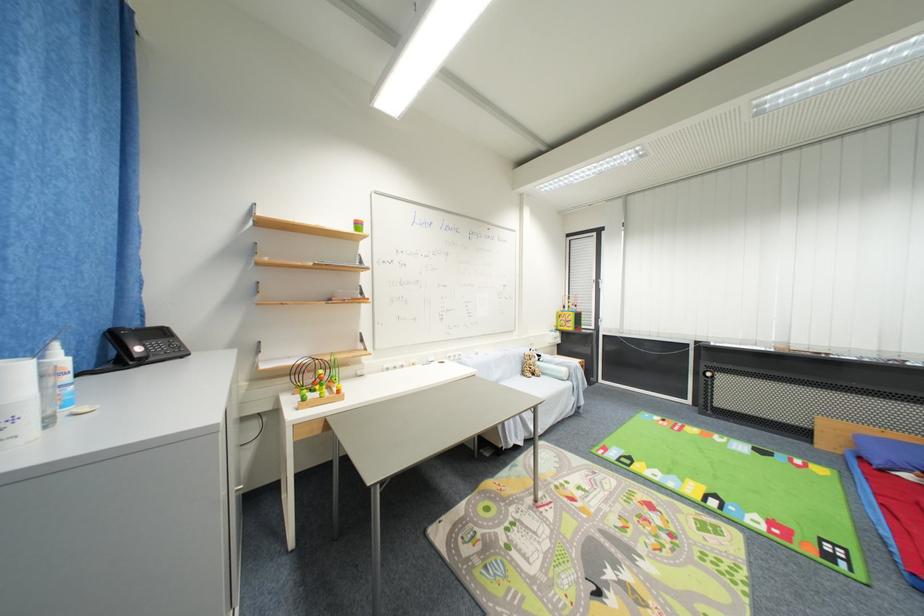
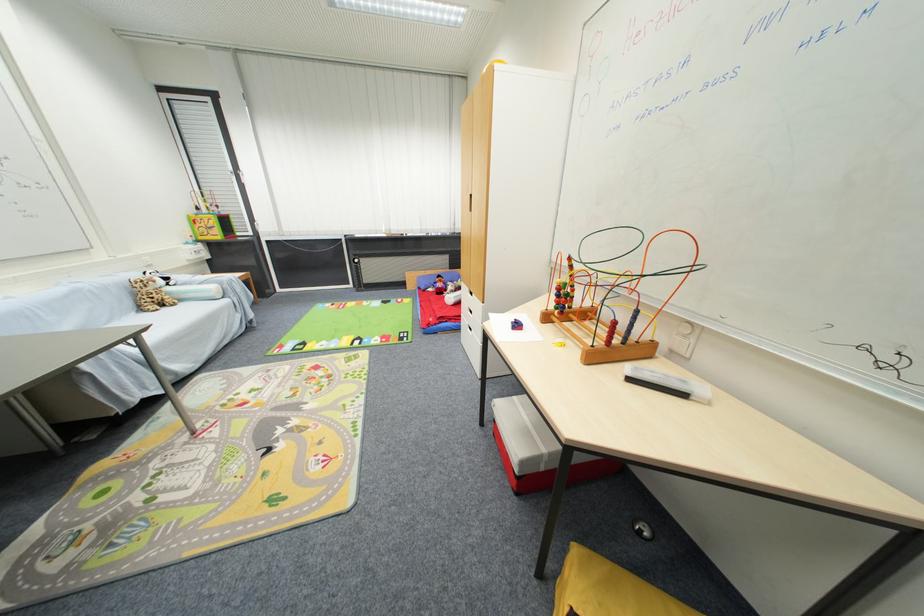
In the second image, find the point that corresponds to pixel 575 330 in the first image.

(223, 238)